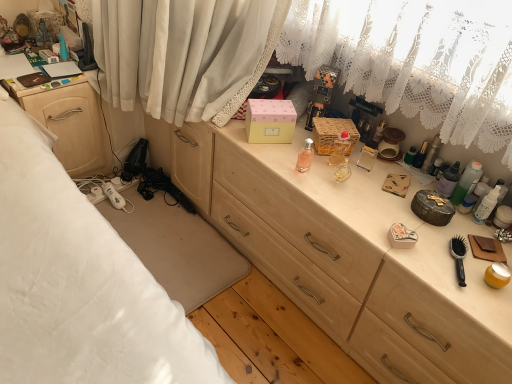
Find the location of a particular element. This screenshot has width=512, height=384. vacant space situated above light wood desk at center (from a real-world perspective) is located at coordinates (399, 198).